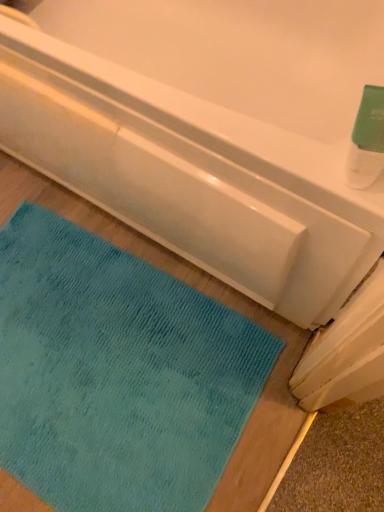
This screenshot has height=512, width=384. What do you see at coordinates (367, 140) in the screenshot?
I see `green matte bottle at upper right` at bounding box center [367, 140].

The height and width of the screenshot is (512, 384). What do you see at coordinates (116, 374) in the screenshot? I see `teal plush mat at lower left` at bounding box center [116, 374].

Identify the location of matte white bathtub at upper center. (209, 132).

Looking at the image, does green matte bottle at upper right seem bigger or smaller compared to matte white bathtub at upper center?

In the image, green matte bottle at upper right appears to be smaller than matte white bathtub at upper center.

Looking at this image, is green matte bottle at upper right facing away from matte white bathtub at upper center?

No, green matte bottle at upper right's orientation is not away from matte white bathtub at upper center.

Considering the sizes of objects green matte bottle at upper right and matte white bathtub at upper center in the image provided, who is taller, green matte bottle at upper right or matte white bathtub at upper center?

green matte bottle at upper right is taller.

How different are the orientations of green matte bottle at upper right and matte white bathtub at upper center in degrees?

The angle between the facing direction of green matte bottle at upper right and the facing direction of matte white bathtub at upper center is 88.6 degrees.

From the image's perspective, is matte white bathtub at upper center above or below green matte bottle at upper right?

Based on their image positions, matte white bathtub at upper center is located beneath green matte bottle at upper right.

In terms of height, does matte white bathtub at upper center look taller or shorter compared to green matte bottle at upper right?

Considering their sizes, matte white bathtub at upper center has less height than green matte bottle at upper right.

Between matte white bathtub at upper center and green matte bottle at upper right, which one has smaller size?

Smaller between the two is green matte bottle at upper right.

Is matte white bathtub at upper center thinner than green matte bottle at upper right?

No.

Is matte white bathtub at upper center turned away from teal plush mat at lower left?

That's not correct — matte white bathtub at upper center is not looking away from teal plush mat at lower left.

From the image's perspective, between matte white bathtub at upper center and teal plush mat at lower left, who is located below?

teal plush mat at lower left.

Which object is positioned more to the left, matte white bathtub at upper center or teal plush mat at lower left?

matte white bathtub at upper center is more to the left.

Is green matte bottle at upper right looking in the opposite direction of teal plush mat at lower left?

No.

From a real-world perspective, is green matte bottle at upper right below teal plush mat at lower left?

No, from a real-world perspective, green matte bottle at upper right is not beneath teal plush mat at lower left.

Is green matte bottle at upper right next to teal plush mat at lower left?

green matte bottle at upper right and teal plush mat at lower left are not in contact.

This screenshot has width=384, height=512. Find the location of `mat that appears below the green matte bottle at upper right (from a real-world perspective)`. mat that appears below the green matte bottle at upper right (from a real-world perspective) is located at coordinates (116, 374).

I want to click on bathtub that is on the left side of teal plush mat at lower left, so click(x=209, y=132).

In the scene shown: Is there a large distance between teal plush mat at lower left and matte white bathtub at upper center?

No, teal plush mat at lower left is in close proximity to matte white bathtub at upper center.

From a real-world perspective, which object stands above the other?

teal plush mat at lower left, from a real-world perspective.

Would you say teal plush mat at lower left is outside matte white bathtub at upper center?

No, teal plush mat at lower left is not outside of matte white bathtub at upper center.

Who is smaller, teal plush mat at lower left or green matte bottle at upper right?

green matte bottle at upper right.

Find the location of `mat on the left of green matte bottle at upper right`. mat on the left of green matte bottle at upper right is located at coordinates (116, 374).

Is teal plush mat at lower left in contact with green matte bottle at upper right?

No, teal plush mat at lower left is not beside green matte bottle at upper right.

Which object is positioned more to the left, teal plush mat at lower left or green matte bottle at upper right?

teal plush mat at lower left is more to the left.

Where is `cleaning product above the matte white bathtub at upper center (from the image's perspective)`? This screenshot has height=512, width=384. cleaning product above the matte white bathtub at upper center (from the image's perspective) is located at coordinates (367, 140).

The image size is (384, 512). Find the location of `bathtub lying below the green matte bottle at upper right (from the image's perspective)`. bathtub lying below the green matte bottle at upper right (from the image's perspective) is located at coordinates (209, 132).

Which object lies nearer to the anchor point teal plush mat at lower left, green matte bottle at upper right or matte white bathtub at upper center?

Among the two, matte white bathtub at upper center is located nearer to teal plush mat at lower left.

Considering their positions, is green matte bottle at upper right positioned further to matte white bathtub at upper center than teal plush mat at lower left?

green matte bottle at upper right is further to matte white bathtub at upper center.

Based on their spatial positions, is matte white bathtub at upper center or teal plush mat at lower left closer to green matte bottle at upper right?

matte white bathtub at upper center.

Based on their spatial positions, is matte white bathtub at upper center or green matte bottle at upper right further from teal plush mat at lower left?

green matte bottle at upper right lies further to teal plush mat at lower left than the other object.

From the image, which object appears to be nearer to matte white bathtub at upper center, teal plush mat at lower left or green matte bottle at upper right?

Based on the image, teal plush mat at lower left appears to be nearer to matte white bathtub at upper center.

Looking at this image, estimate the real-world distances between objects in this image. Which object is further from green matte bottle at upper right, teal plush mat at lower left or matte white bathtub at upper center?

teal plush mat at lower left lies further to green matte bottle at upper right than the other object.

Find the location of a particular element. This screenshot has width=384, height=512. mat between matte white bathtub at upper center and green matte bottle at upper right in the horizontal direction is located at coordinates (116, 374).